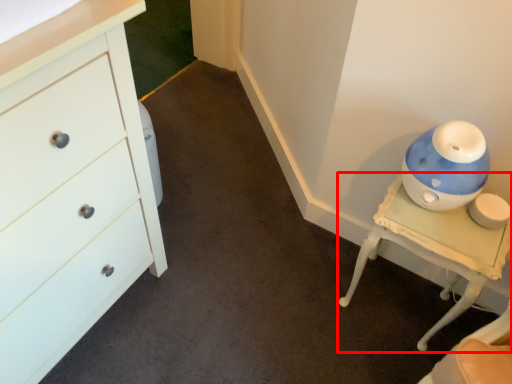
Question: From the image's perspective, what is the correct spatial positioning of furniture (annotated by the red box) in reference to chest of drawers?

Choices:
 (A) above
 (B) below

Answer: (B)